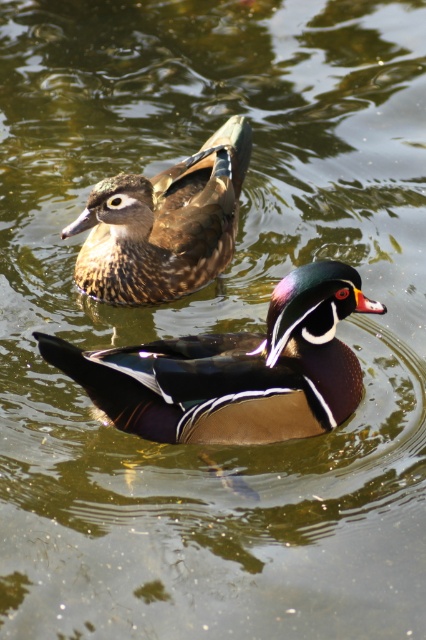
You are an ornithologist observing two ducks in a pond. You notice a shiny brown duck at center and a brown speckled wood duck at upper left. Which duck do you think is the smaller one?

The shiny brown duck at center is smaller than the brown speckled wood duck at upper left.

You are observing two points in the image of the ducks. The first point is at coordinates point (245, 442) and the second is at point (178, 234). Which point appears closer to you?

Point (245, 442) is closer to the camera than point (178, 234).